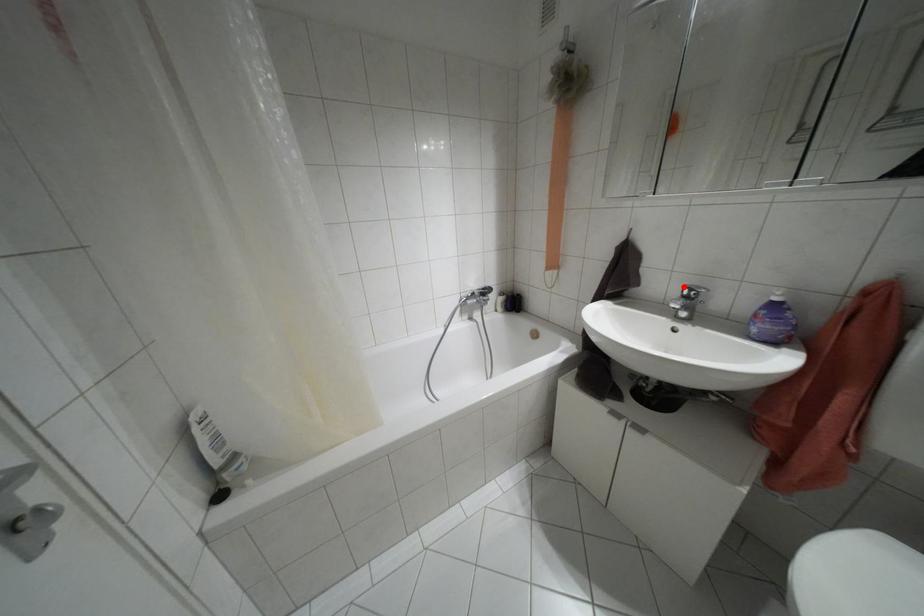
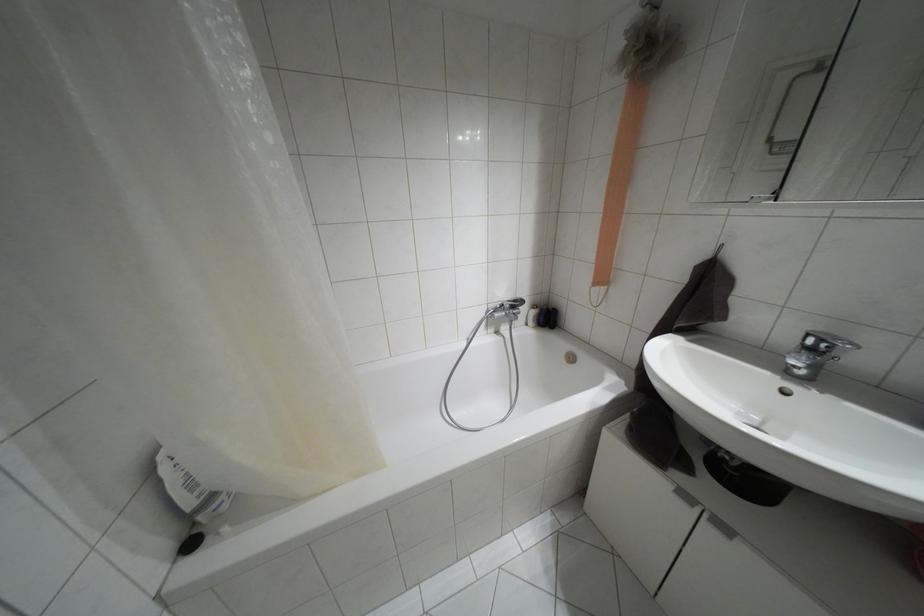
In the second image, find the point that corresponds to the highlighted location in the first image.

(808, 334)